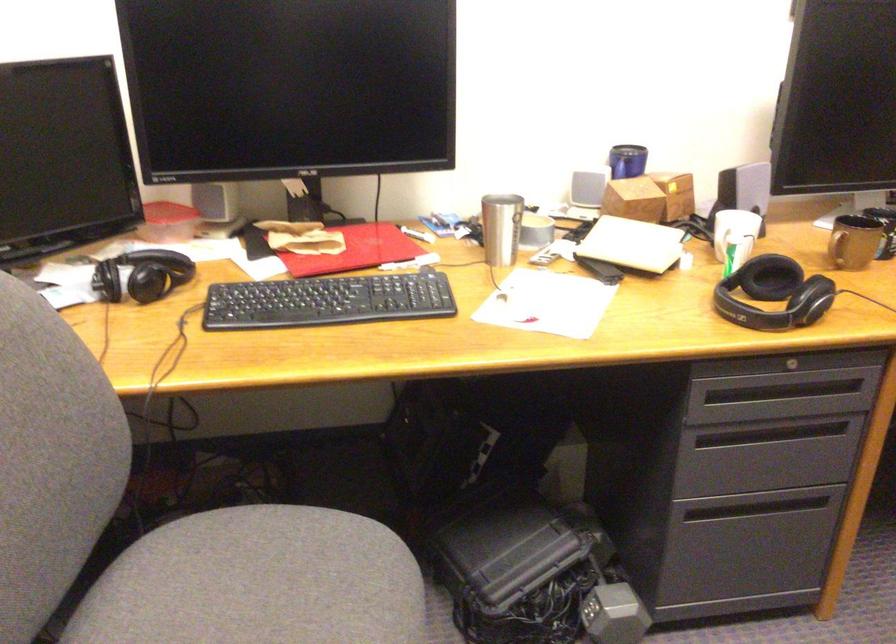
At what (x,y) coordinates should I click in order to perform the action: click on chair sitting surface. Please return your answer as a coordinate pair (x, y). This screenshot has width=896, height=644. Looking at the image, I should click on (269, 579).